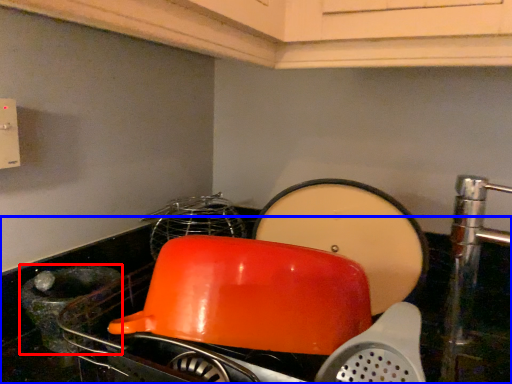
Question: Which object appears closest to the camera in this image, appliance (highlighted by a red box) or counter top (highlighted by a blue box)?

Choices:
 (A) appliance
 (B) counter top

Answer: (B)